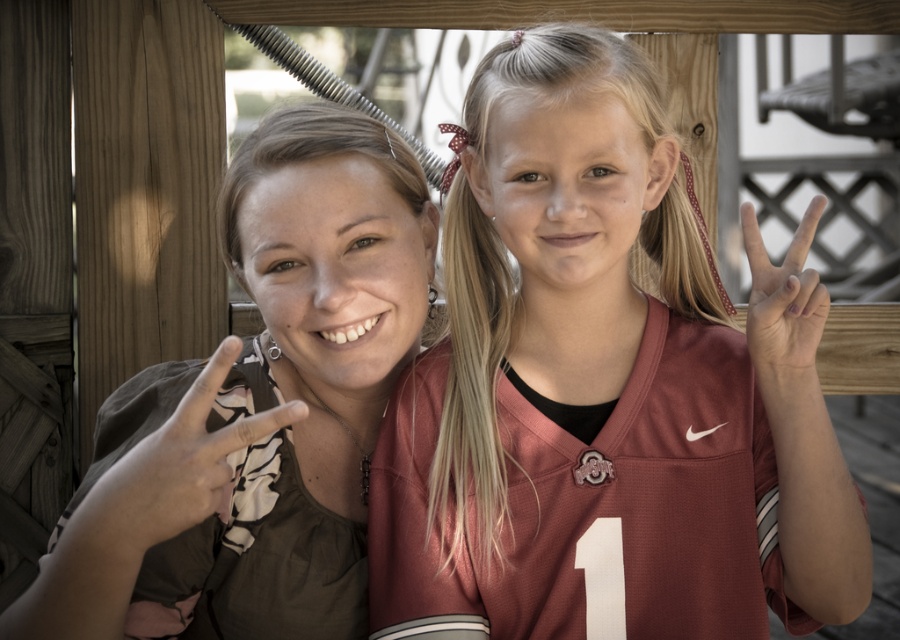
Question: Which of these objects is positioned closest to the matte jersey at center?

Choices:
 (A) matte brown hand at left
 (B) matte brown shirt at left

Answer: (B)

Question: Is matte brown shirt at left below matte brown hand at left?

Choices:
 (A) yes
 (B) no

Answer: (B)

Question: Can you confirm if matte jersey at center is positioned to the right of matte red jersey at right?

Choices:
 (A) yes
 (B) no

Answer: (B)

Question: Based on their relative distances, which object is farther from the matte brown hand at left?

Choices:
 (A) matte red jersey at right
 (B) matte jersey at center
 (C) matte brown shirt at left

Answer: (A)

Question: Among these points, which one is farthest from the camera?

Choices:
 (A) (796, 387)
 (B) (176, 496)
 (C) (117, 480)

Answer: (A)

Question: Can you confirm if matte jersey at center is bigger than matte brown hand at left?

Choices:
 (A) no
 (B) yes

Answer: (B)